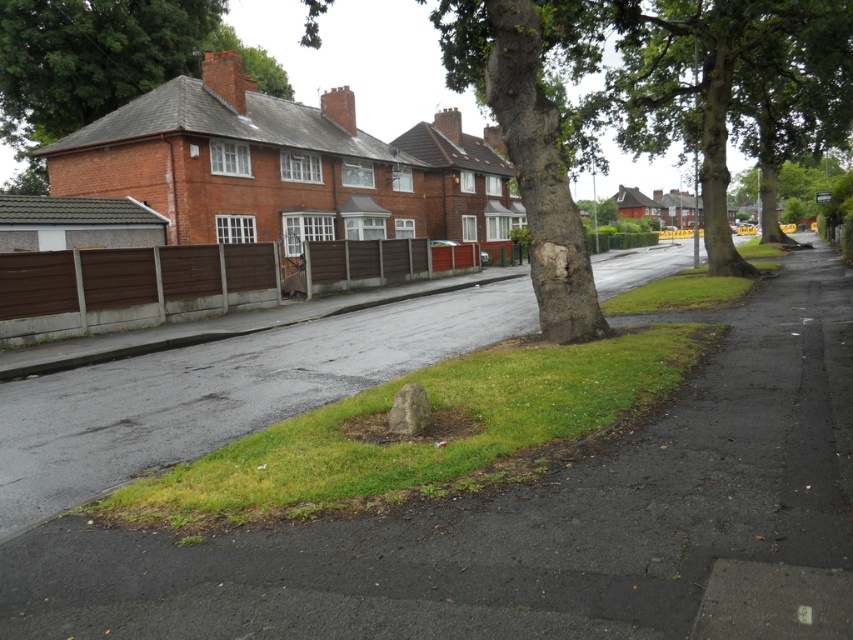
Question: Which object is the farthest from the green leafy tree at upper center?

Choices:
 (A) green leafy tree at upper right
 (B) green leafy tree at center

Answer: (A)

Question: Does green leafy tree at center come in front of green leafy tree at upper center?

Choices:
 (A) no
 (B) yes

Answer: (B)

Question: Can you confirm if green leafy tree at center is positioned to the left of green leafy tree at upper center?

Choices:
 (A) yes
 (B) no

Answer: (B)

Question: Which of the following is the farthest from the observer?

Choices:
 (A) green leafy tree at upper center
 (B) green leafy tree at center
 (C) green leafy tree at upper right

Answer: (A)

Question: Which point appears closest to the camera in this image?

Choices:
 (A) (711, 10)
 (B) (833, 164)
 (C) (86, 92)

Answer: (A)

Question: Is green leafy tree at center above green leafy tree at upper center?

Choices:
 (A) yes
 (B) no

Answer: (B)